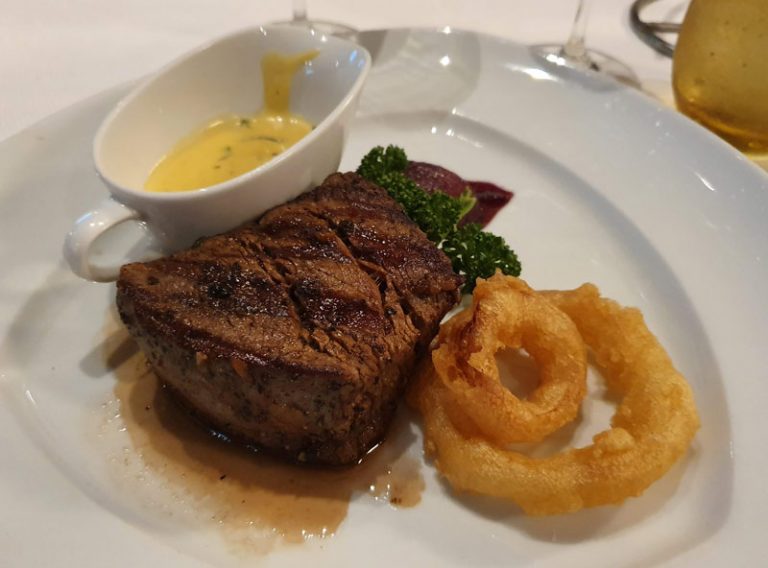
I want to click on white plate, so click(647, 242).